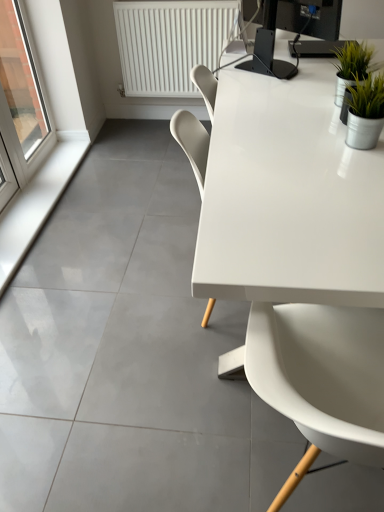
Question: Is transparent glass window at left facing towards white smooth window sill at lower left?

Choices:
 (A) no
 (B) yes

Answer: (A)

Question: Is transparent glass window at left further to camera compared to white smooth window sill at lower left?

Choices:
 (A) no
 (B) yes

Answer: (B)

Question: Is transparent glass window at left in contact with white smooth window sill at lower left?

Choices:
 (A) no
 (B) yes

Answer: (A)

Question: Is transparent glass window at left at the left side of white smooth window sill at lower left?

Choices:
 (A) yes
 (B) no

Answer: (A)

Question: Considering the relative sizes of transparent glass window at left and white smooth window sill at lower left in the image provided, is transparent glass window at left shorter than white smooth window sill at lower left?

Choices:
 (A) yes
 (B) no

Answer: (B)

Question: In the image, is white plastic radiator at upper center on the left side or the right side of white smooth window sill at lower left?

Choices:
 (A) right
 (B) left

Answer: (A)

Question: From the image's perspective, is white plastic radiator at upper center positioned above or below white smooth window sill at lower left?

Choices:
 (A) below
 (B) above

Answer: (B)

Question: Is point (132, 92) positioned closer to the camera than point (19, 248)?

Choices:
 (A) farther
 (B) closer

Answer: (A)

Question: Based on their sizes in the image, would you say white plastic radiator at upper center is bigger or smaller than white smooth window sill at lower left?

Choices:
 (A) big
 (B) small

Answer: (A)

Question: In the image, is white glossy table at upper right positioned in front of or behind white plastic radiator at upper center?

Choices:
 (A) behind
 (B) front

Answer: (B)

Question: From a real-world perspective, is white glossy table at upper right positioned above or below white plastic radiator at upper center?

Choices:
 (A) below
 (B) above

Answer: (A)

Question: In terms of height, does white glossy table at upper right look taller or shorter compared to white plastic radiator at upper center?

Choices:
 (A) short
 (B) tall

Answer: (B)

Question: Looking at the image, does white glossy table at upper right seem bigger or smaller compared to white plastic radiator at upper center?

Choices:
 (A) big
 (B) small

Answer: (A)

Question: From the image's perspective, is green metallic pot at upper right located above or below black glossy monitor at upper right?

Choices:
 (A) above
 (B) below

Answer: (B)

Question: Choose the correct answer: Is green metallic pot at upper right inside black glossy monitor at upper right or outside it?

Choices:
 (A) inside
 (B) outside

Answer: (B)